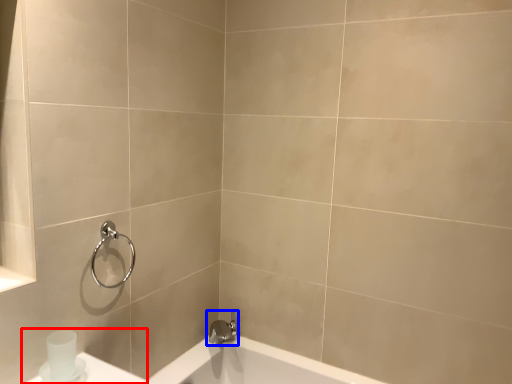
Question: Which point is closer to the camera, sink (highlighted by a red box) or tap (highlighted by a blue box)?

Choices:
 (A) sink
 (B) tap

Answer: (A)